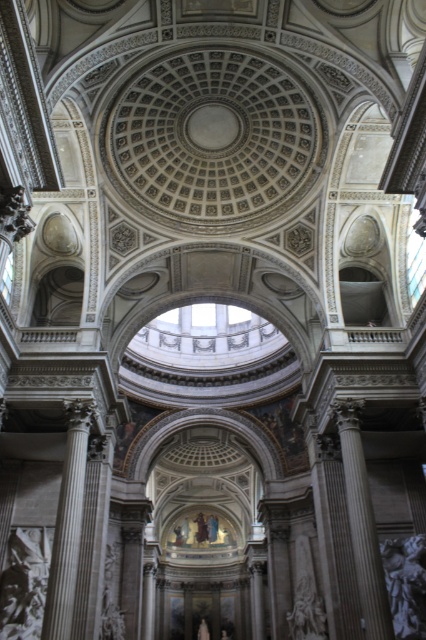
Can you confirm if white marble column at left is thinner than gray marble column at right?

Indeed, white marble column at left has a lesser width compared to gray marble column at right.

Based on the photo, does white marble column at left have a smaller size compared to gray marble column at right?

Actually, white marble column at left might be larger than gray marble column at right.

This screenshot has width=426, height=640. What are the coordinates of `white marble column at left` in the screenshot? It's located at (68, 524).

The width and height of the screenshot is (426, 640). Find the location of `white marble column at left`. white marble column at left is located at coordinates (68, 524).